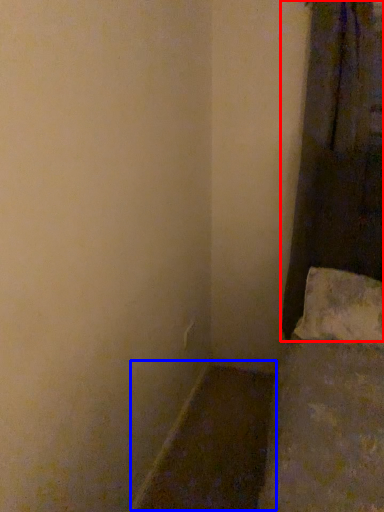
Question: Among these objects, which one is nearest to the camera, curtain (highlighted by a red box) or window sill (highlighted by a blue box)?

Choices:
 (A) curtain
 (B) window sill

Answer: (B)